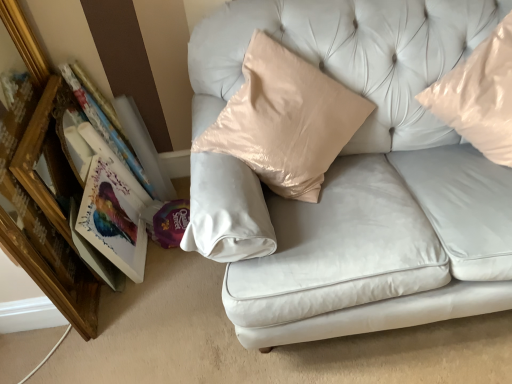
Question: From a real-world perspective, is matte cardboard book at left above or below satin white couch at center?

Choices:
 (A) above
 (B) below

Answer: (B)

Question: Considering their positions, is matte cardboard book at left located in front of or behind satin white couch at center?

Choices:
 (A) behind
 (B) front

Answer: (A)

Question: Considering the real-world distances, which object is farthest from the satin white couch at center?

Choices:
 (A) wooden picture frame at left
 (B) matte cardboard book at left
 (C) matte paper book at left
 (D) glossy plastic pillow at upper right

Answer: (A)

Question: Considering the real-world distances, which object is closest to the matte cardboard book at left?

Choices:
 (A) wooden picture frame at left
 (B) glossy plastic pillow at upper right
 (C) matte paper book at left
 (D) satin white couch at center

Answer: (C)